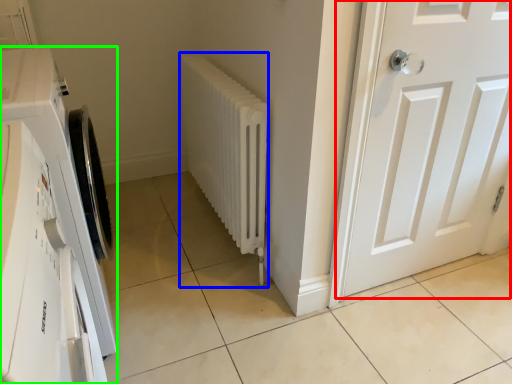
Question: Which object is the closest to the door (highlighted by a red box)? Choose among these: radiator (highlighted by a blue box) or washing machine (highlighted by a green box).

Choices:
 (A) radiator
 (B) washing machine

Answer: (A)